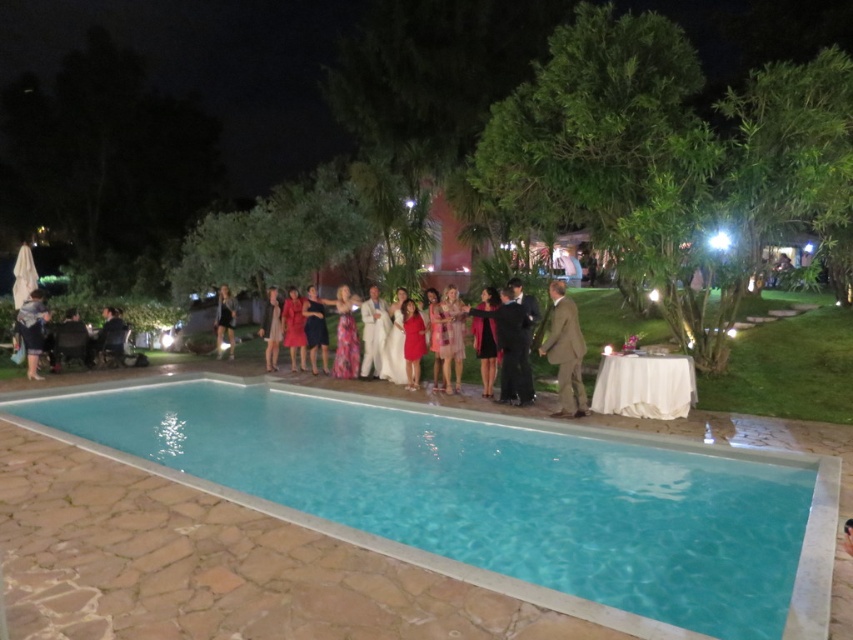
Question: Which of the following is the closest to the observer?

Choices:
 (A) shiny black dress at center
 (B) satin brown suit at center

Answer: (B)

Question: Is clear blue water at center bigger than satin brown suit at center?

Choices:
 (A) no
 (B) yes

Answer: (A)

Question: Among these points, which one is nearest to the camera?

Choices:
 (A) (227, 289)
 (B) (253, 456)

Answer: (B)

Question: Is satin brown suit at center bigger than denim jacket at lower left?

Choices:
 (A) yes
 (B) no

Answer: (B)

Question: Is clear blue water at center to the right of satin brown suit at center from the viewer's perspective?

Choices:
 (A) yes
 (B) no

Answer: (B)

Question: Which is farther from the satin brown suit at center?

Choices:
 (A) shiny black dress at center
 (B) clear blue water at center

Answer: (A)